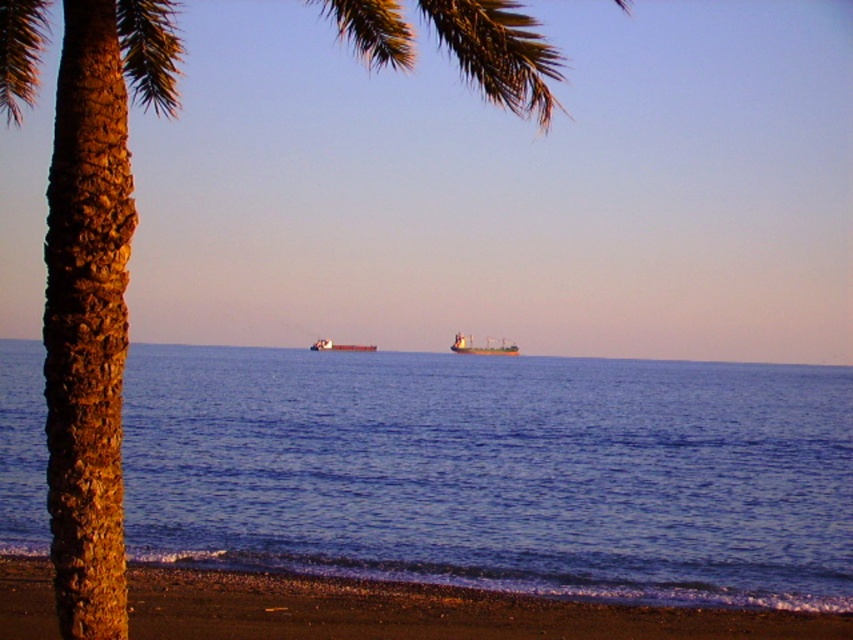
Question: Is smooth sand beach at lower left to the left of brown matte cargo ship at center from the viewer's perspective?

Choices:
 (A) no
 (B) yes

Answer: (A)

Question: Which point is farther to the camera?

Choices:
 (A) smooth sand beach at lower left
 (B) blue water at center
 (C) metallic gray cargo ship at center

Answer: (C)

Question: Which object is farther from the camera taking this photo?

Choices:
 (A) smooth sand beach at lower left
 (B) brown textured palm tree at left
 (C) blue water at center

Answer: (C)

Question: Among these objects, which one is nearest to the camera?

Choices:
 (A) brown textured palm tree at left
 (B) blue water at center

Answer: (A)

Question: Can you confirm if smooth sand beach at lower left is smaller than metallic gray cargo ship at center?

Choices:
 (A) yes
 (B) no

Answer: (A)

Question: Observing the image, what is the correct spatial positioning of blue water at center in reference to brown matte cargo ship at center?

Choices:
 (A) left
 (B) right

Answer: (B)